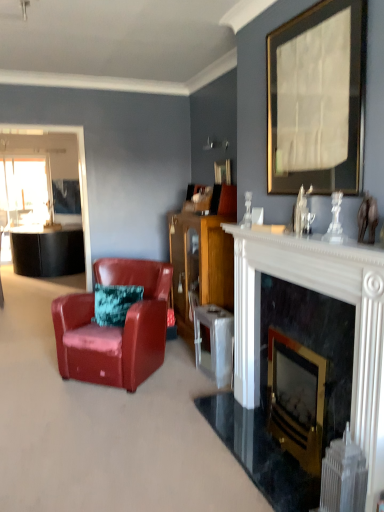
The height and width of the screenshot is (512, 384). I want to click on leather armchair at left, so click(115, 327).

Describe the element at coordinates (329, 296) in the screenshot. I see `black marble fireplace at center, which ranks as the 1th fireplace in left-to-right order` at that location.

What is the approximate height of white marble fireplace at center?

It is 3.39 inches.

Measure the distance between gold-framed paper at upper center, which is the second picture frame in left-to-right order, and camera.

The distance of gold-framed paper at upper center, which is the second picture frame in left-to-right order, from camera is 5.44 feet.

The width and height of the screenshot is (384, 512). What do you see at coordinates (317, 99) in the screenshot?
I see `gold-framed paper at upper center, which appears as the first picture frame when viewed from the right` at bounding box center [317, 99].

What are the coordinates of `wooden cabinet at center` in the screenshot? It's located at (201, 262).

The image size is (384, 512). What are the coordinates of `black marble fireplace at center, acting as the 1th fireplace starting from the right` in the screenshot? It's located at click(x=305, y=368).

Identify the location of leather armchair at left. (115, 327).

Can we say metallic silver table at center lies outside white marble fireplace at center?

Absolutely, metallic silver table at center is external to white marble fireplace at center.

Considering the sizes of objects metallic silver table at center and white marble fireplace at center in the image provided, who is smaller, metallic silver table at center or white marble fireplace at center?

With smaller size is white marble fireplace at center.

Is metallic silver table at center next to white marble fireplace at center?

No, metallic silver table at center is not touching white marble fireplace at center.

In the scene shown: From the image's perspective, which one is positioned higher, metallic silver table at center or white marble fireplace at center?

From the image's view, white marble fireplace at center is above.

Locate an element on the screen. The width and height of the screenshot is (384, 512). table below the wooden cabinet at center (from the image's perspective) is located at coordinates (215, 341).

Considering the relative positions of metallic silver table at center and wooden cabinet at center in the image provided, is metallic silver table at center to the left or to the right of wooden cabinet at center?

metallic silver table at center is positioned on wooden cabinet at center's right side.

Could you tell me if metallic silver table at center is facing wooden cabinet at center?

No.

Is there a large distance between gold-framed paper at upper center, which is the second picture frame in left-to-right order, and white plastic radiator at lower right?

That's right, there is a large distance between gold-framed paper at upper center, which is the second picture frame in left-to-right order, and white plastic radiator at lower right.

Who is bigger, gold-framed paper at upper center, the 2th picture frame viewed from the back, or white plastic radiator at lower right?

With larger size is gold-framed paper at upper center, the 2th picture frame viewed from the back.

Relative to white plastic radiator at lower right, is gold-framed paper at upper center, which is the second picture frame in left-to-right order, in front or behind?

Visually, gold-framed paper at upper center, which is the second picture frame in left-to-right order, is located behind white plastic radiator at lower right.

Considering the sizes of gold-framed paper at upper center, which appears as the first picture frame when viewed from the right, and white plastic radiator at lower right in the image, is gold-framed paper at upper center, which appears as the first picture frame when viewed from the right, taller or shorter than white plastic radiator at lower right?

Clearly, gold-framed paper at upper center, which appears as the first picture frame when viewed from the right, is taller compared to white plastic radiator at lower right.

Is metallic silver table at center at the back of wooden cabinet at center?

wooden cabinet at center does not have its back to metallic silver table at center.

Does point (208, 268) lie in front of point (216, 337)?

No, (208, 268) is further to viewer.

Is the position of metallic silver table at center less distant than that of clear glass window screen at left?

Yes.

Does metallic silver table at center have a smaller size compared to clear glass window screen at left?

Indeed, metallic silver table at center has a smaller size compared to clear glass window screen at left.

Based on their positions, is metallic silver table at center located to the left or right of clear glass window screen at left?

Clearly, metallic silver table at center is on the right of clear glass window screen at left in the image.

Does point (250, 343) appear closer or farther from the camera than point (358, 510)?

Clearly, point (250, 343) is more distant from the camera than point (358, 510).

Which of these two, black marble fireplace at center, the second fireplace positioned from the right, or white plastic radiator at lower right, is bigger?

black marble fireplace at center, the second fireplace positioned from the right.

Between black marble fireplace at center, which ranks as the 1th fireplace in left-to-right order, and white plastic radiator at lower right, which one has larger width?

Wider between the two is white plastic radiator at lower right.

Consider the image. In the image, is black marble fireplace at center, the second fireplace positioned from the right, positioned in front of or behind white plastic radiator at lower right?

In the image, black marble fireplace at center, the second fireplace positioned from the right, appears in front of white plastic radiator at lower right.

Which is behind, point (203, 222) or point (48, 216)?

Positioned behind is point (48, 216).

Is wooden cabinet at center closer to the viewer compared to clear glass window screen at left?

Yes, it is in front of clear glass window screen at left.

Which of these two, wooden cabinet at center or clear glass window screen at left, is smaller?

clear glass window screen at left.

I want to click on mantle on the right of metallic silver table at center, so click(x=299, y=249).

Find the location of a particular element. The image size is (384, 512). table directly beneath the wooden cabinet at center (from a real-world perspective) is located at coordinates (215, 341).

Based on their spatial positions, is wooden picture frame at upper center, the first picture frame viewed from the left, or white plastic radiator at lower right closer to black marble fireplace at center, which ranks as the 1th fireplace in left-to-right order?

white plastic radiator at lower right.

Which object lies nearer to the anchor point gold-framed paper at upper center, which is the second picture frame in left-to-right order, wooden picture frame at upper center, which ranks as the second picture frame in front-to-back order, or white marble fireplace at center?

Based on the image, white marble fireplace at center appears to be nearer to gold-framed paper at upper center, which is the second picture frame in left-to-right order.

Looking at the image, which one is located closer to wooden picture frame at upper center, the first picture frame viewed from the left, wooden cabinet at center or leather armchair at left?

Among the two, wooden cabinet at center is located nearer to wooden picture frame at upper center, the first picture frame viewed from the left.

Considering their positions, is wooden cabinet at center positioned further to leather armchair at left than white plastic radiator at lower right?

Among the two, white plastic radiator at lower right is located further to leather armchair at left.

Considering their positions, is gold-framed paper at upper center, which is the second picture frame in left-to-right order, positioned closer to black marble fireplace at center, which ranks as the 1th fireplace in left-to-right order, than clear glass window screen at left?

Among the two, gold-framed paper at upper center, which is the second picture frame in left-to-right order, is located nearer to black marble fireplace at center, which ranks as the 1th fireplace in left-to-right order.

Based on the photo, from the image, which object appears to be nearer to wooden cabinet at center, white marble fireplace at center or clear glass window screen at left?

white marble fireplace at center.

Based on their spatial positions, is white plastic radiator at lower right or gold-framed paper at upper center, which appears as the first picture frame when viewed from the right, further from metallic silver table at center?

gold-framed paper at upper center, which appears as the first picture frame when viewed from the right, lies further to metallic silver table at center than the other object.

Based on their spatial positions, is wooden picture frame at upper center, acting as the 2th picture frame starting from the right, or black marble fireplace at center, acting as the 1th fireplace starting from the right, closer to wooden cabinet at center?

wooden picture frame at upper center, acting as the 2th picture frame starting from the right, is positioned closer to the anchor wooden cabinet at center.

I want to click on table between white marble fireplace at center and wooden picture frame at upper center, the first picture frame viewed from the left, along the z-axis, so click(x=215, y=341).

Where is `fireplace between white marble fireplace at center and black marble fireplace at center, acting as the 1th fireplace starting from the right, from top to bottom`? fireplace between white marble fireplace at center and black marble fireplace at center, acting as the 1th fireplace starting from the right, from top to bottom is located at coordinates click(x=329, y=296).

Image resolution: width=384 pixels, height=512 pixels. In order to click on fireplace positioned between black marble fireplace at center, the second fireplace positioned from the right, and metallic silver table at center from near to far in this screenshot , I will do `click(305, 368)`.

This screenshot has height=512, width=384. In order to click on chair located between black marble fireplace at center, arranged as the 2th fireplace when viewed from the left, and clear glass window screen at left in the depth direction in this screenshot , I will do `click(115, 327)`.